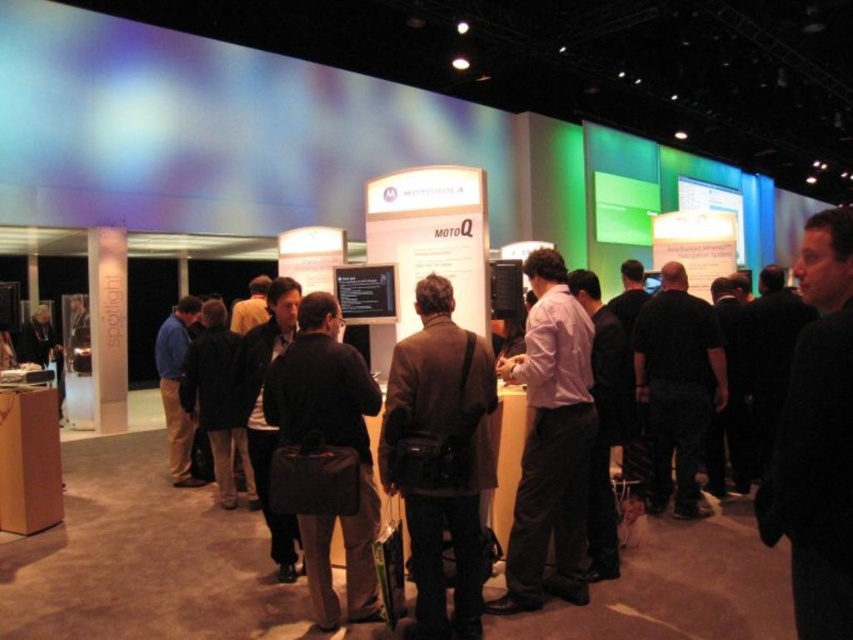
Question: Is brown leather jacket at center bigger than purple cotton shirt at center?

Choices:
 (A) no
 (B) yes

Answer: (A)

Question: Is dark brown leather jacket at center positioned before purple cotton shirt at center?

Choices:
 (A) no
 (B) yes

Answer: (B)

Question: Is brown leather jacket at center thinner than dark brown leather jacket at center?

Choices:
 (A) no
 (B) yes

Answer: (B)

Question: Which object is farther from the camera taking this photo?

Choices:
 (A) brown leather jacket at center
 (B) dark brown leather jacket at center
 (C) purple cotton shirt at center

Answer: (C)

Question: Which point is closer to the camera?

Choices:
 (A) purple cotton shirt at center
 (B) dark brown leather jacket at center

Answer: (B)

Question: Based on their relative distances, which object is farther from the brown leather jacket at center?

Choices:
 (A) dark brown leather jacket at center
 (B) purple cotton shirt at center

Answer: (B)